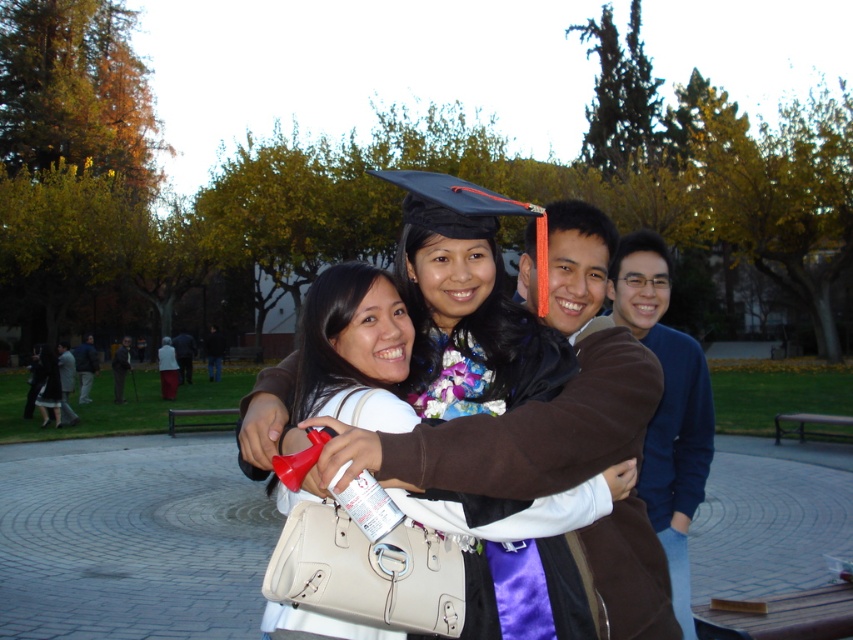
You are a photographer at the graduation ceremony. You need to capture a photo where the matte black graduation cap at center and the blue cotton sweater at right are both visible. Based on their positions, which object should you focus on first to ensure both are in frame?

The matte black graduation cap at center is located above the blue cotton sweater at right, so you should focus on the blue cotton sweater at right first to ensure both are in frame.

You are standing in the park and want to take a photo of both point (509, 388) and point (465, 413) in the image. Which point is closer to you so that you can focus on it first?

Point (509, 388) is closer to you than point (465, 413), so you should focus on it first to ensure it is in clear view.

You are standing at the location of the light gray wool coat at lower left and want to throw a small paper airplane to the matte black graduation cap at center. Given that the paper airplane can travel up to 15 meters, will it reach the target?

The matte black graduation cap at center is 18.07 meters away from the light gray wool coat at lower left. Since the paper airplane can only travel up to 15 meters, it will not reach the target.